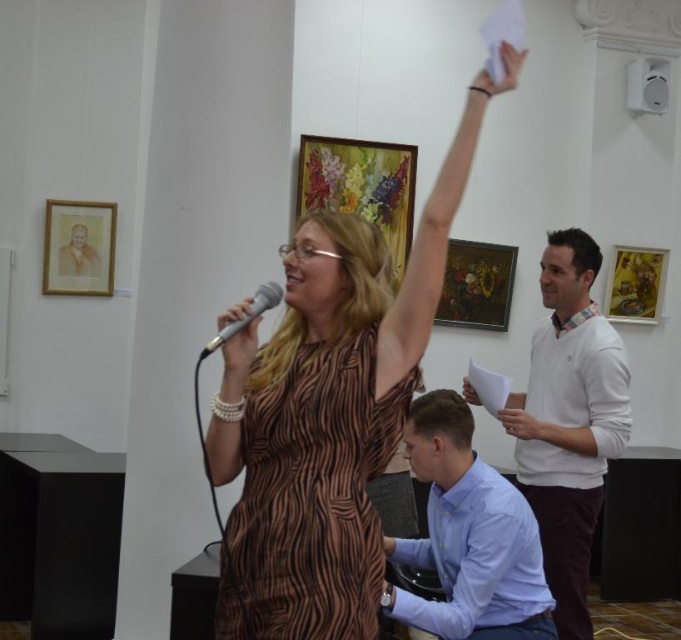
Is point (454, 518) less distant than point (633, 314)?

That is True.

Can you confirm if blue cotton shirt at center is taller than gold-framed painting at upper right?

Yes.

I want to click on blue cotton shirt at center, so click(469, 536).

Is brown textured dress at center thinner than white plastic speaker at upper right?

No, brown textured dress at center is not thinner than white plastic speaker at upper right.

Can you confirm if brown textured dress at center is positioned to the right of white plastic speaker at upper right?

In fact, brown textured dress at center is to the left of white plastic speaker at upper right.

The image size is (681, 640). What do you see at coordinates (330, 412) in the screenshot?
I see `brown textured dress at center` at bounding box center [330, 412].

The image size is (681, 640). Find the location of `brown textured dress at center`. brown textured dress at center is located at coordinates (330, 412).

Looking at this image, which is more to the left, brown textured dress at center or wooden framed floral painting at upper center?

brown textured dress at center

How distant is brown textured dress at center from wooden framed floral painting at upper center?

The distance of brown textured dress at center from wooden framed floral painting at upper center is 3.02 meters.

Between point (381, 328) and point (394, 150), which one is positioned behind?

Point (394, 150)

The height and width of the screenshot is (640, 681). In order to click on brown textured dress at center in this screenshot , I will do `click(330, 412)`.